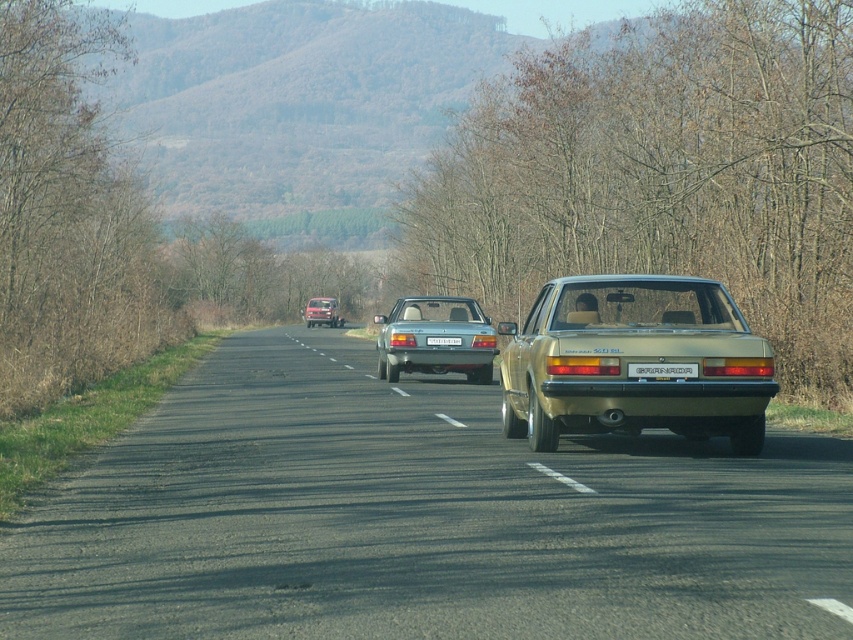
Can you confirm if metallic silver sedan at center is bigger than metallic silver van at center?

No.

Which is above, metallic silver sedan at center or metallic silver van at center?

Positioned higher is metallic silver van at center.

In the scene shown: Who is more distant from viewer, (489,323) or (321,310)?

Point (321,310)

What are the coordinates of `metallic silver sedan at center` in the screenshot? It's located at (434, 336).

Can you confirm if asphalt road at center is positioned above metallic silver van at center?

No, asphalt road at center is not above metallic silver van at center.

Which is above, asphalt road at center or metallic silver van at center?

metallic silver van at center

This screenshot has width=853, height=640. What do you see at coordinates (416, 518) in the screenshot?
I see `asphalt road at center` at bounding box center [416, 518].

Locate an element on the screen. asphalt road at center is located at coordinates (416, 518).

Which is below, white plastic license plate at rear or metallic silver van at center?

Positioned lower is white plastic license plate at rear.

Looking at this image, is white plastic license plate at rear positioned behind metallic silver van at center?

No, it is not.

Measure the distance between point (656, 369) and camera.

A distance of 12.81 meters exists between point (656, 369) and camera.

You are a GUI agent. You are given a task and a screenshot of the screen. Output one action in this format:
    pyautogui.click(x=<x>, y=<y>)
    Task: Click on the white plastic license plate at rear
    
    Given the screenshot: What is the action you would take?
    pyautogui.click(x=662, y=369)